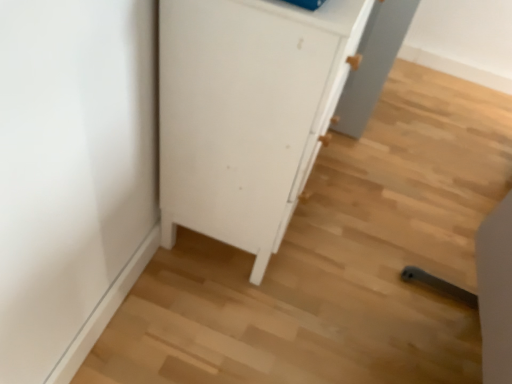
In order to click on vacant area that lies to the right of white matte cabinet at center in this screenshot , I will do `click(375, 213)`.